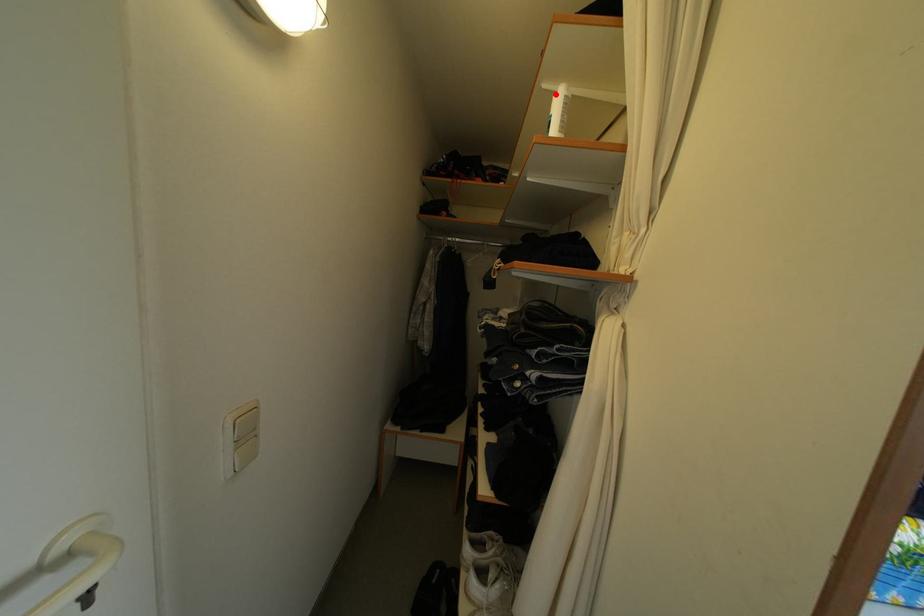
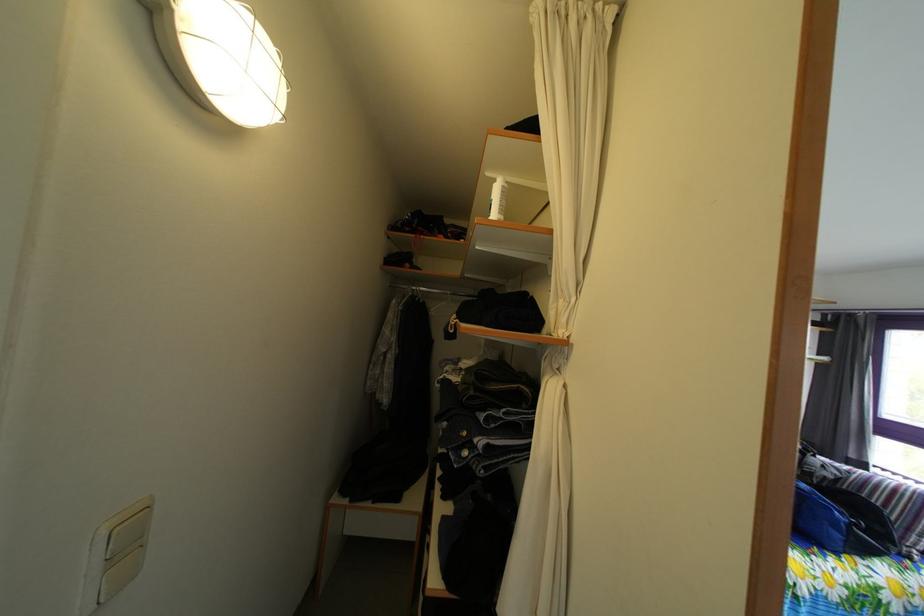
The point at the highlighted location is marked in the first image. Where is the corresponding point in the second image?

(499, 182)